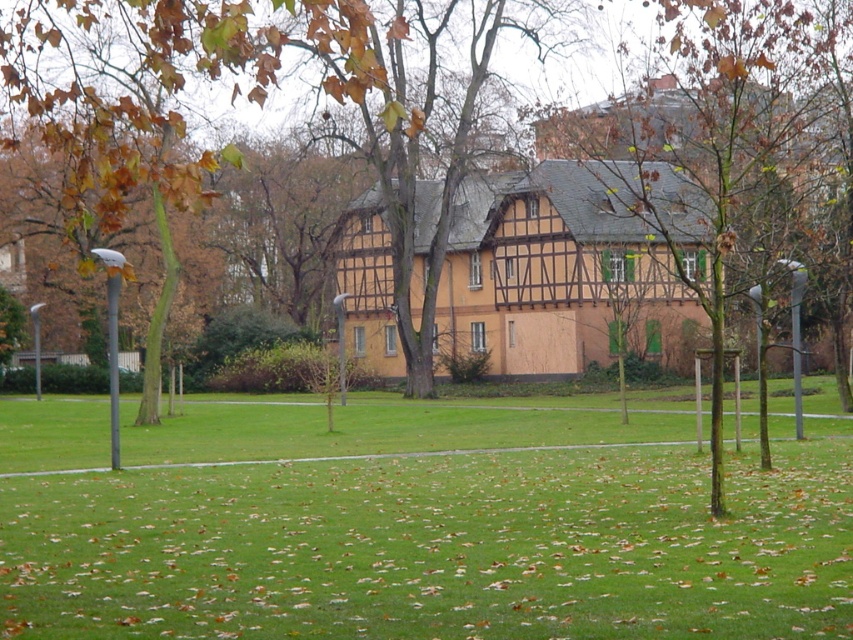
Between point (155, 474) and point (724, 161), which one is positioned in front?

Point (724, 161)

Describe the element at coordinates (428, 532) in the screenshot. I see `green grass at center` at that location.

Find the location of a particular element. Image resolution: width=853 pixels, height=640 pixels. green grass at center is located at coordinates (428, 532).

The height and width of the screenshot is (640, 853). In order to click on green grass at center in this screenshot , I will do `click(428, 532)`.